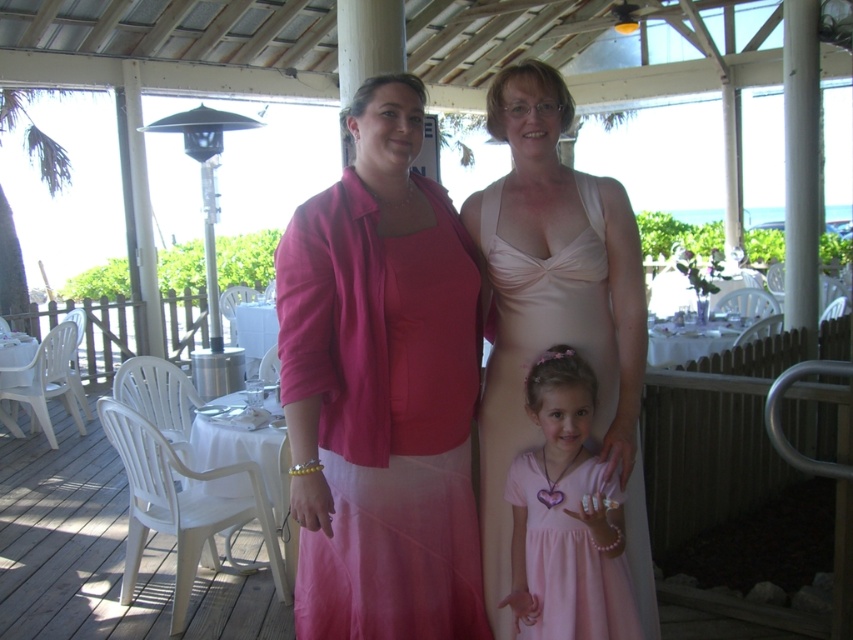
You are a photographer trying to capture a group photo of the matte pink dress at center and the pink satin dress at center. The camera you are using has a minimum focus distance of 35 centimeters. Will you be able to focus on both dresses without moving closer?

The matte pink dress at center is 38.09 centimeters away from the pink satin dress at center. Since the camera requires a minimum focus distance of 35 centimeters, the dresses are just beyond the required distance, so the camera can focus on both dresses without needing to move closer.

You are standing in front of the group of three people under the covered patio. You need to hand a gift to the person who is closer to you. Which point should you aim for, point 1 at (x=512, y=307) or point 2 at (x=579, y=483)?

Point 1 at (x=512, y=307) is closer to you, so you should aim for that point.

You are a photographer trying to capture a clear photo of both the satin beige dress at center and the pink satin dress at center. Which dress should you focus on first to ensure it appears sharp in the photo?

The satin beige dress at center is closer to the viewer than the pink satin dress at center, so focusing on the satin beige dress at center first will ensure it appears sharp. The pink satin dress at center may appear slightly out of focus if the depth of field is limited.